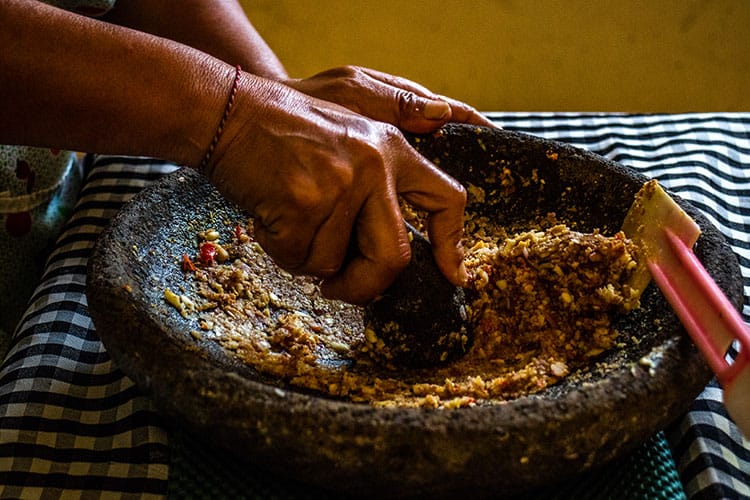
Where is `checkered tablecloth`? checkered tablecloth is located at coordinates (112, 403).